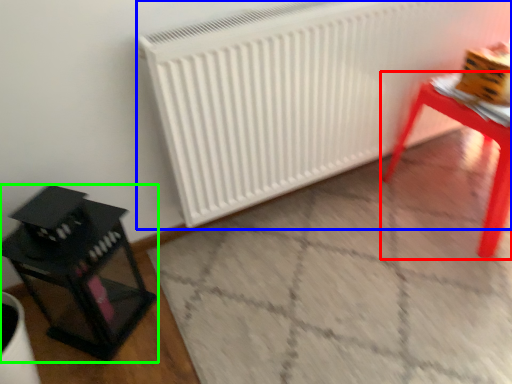
Question: Estimate the real-world distances between objects in this image. Which object is closer to table (highlighted by a red box), radiator (highlighted by a blue box) or furniture (highlighted by a green box)?

Choices:
 (A) radiator
 (B) furniture

Answer: (A)